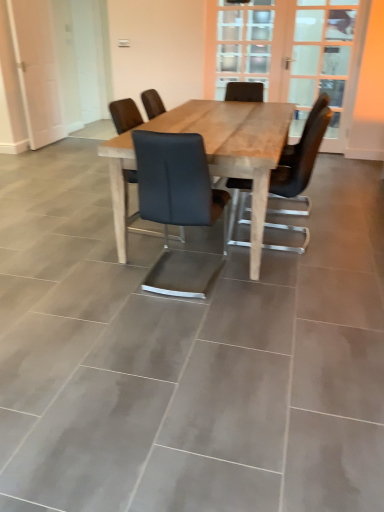
What do you see at coordinates (125, 115) in the screenshot?
I see `matte black chair at center, marked as the 3th chair in a right-to-left arrangement` at bounding box center [125, 115].

I want to click on white glossy door at left, the first screen door in the left-to-right sequence, so click(x=37, y=70).

Describe the element at coordinates (178, 207) in the screenshot. I see `black leather chair at center, the second chair in the right-to-left sequence` at that location.

Describe the element at coordinates (295, 55) in the screenshot. This screenshot has width=384, height=512. I see `clear glass door at upper center, which is the second screen door from left to right` at that location.

Find the location of `clear glass door at upper center, positioned as the first screen door in right-to-left order`. clear glass door at upper center, positioned as the first screen door in right-to-left order is located at coordinates (295, 55).

The width and height of the screenshot is (384, 512). I want to click on clear glass door at upper center, so click(244, 42).

In order to face matte black chair at center, placed as the third chair when sorted from left to right, should I rotate leftwards or rightwards?

A 11.699 degree turn to the right will do.

Where is `matte black chair at center, marked as the 3th chair in a right-to-left arrangement`? matte black chair at center, marked as the 3th chair in a right-to-left arrangement is located at coordinates coord(125,115).

How many degrees apart are the facing directions of clear glass door at upper center and clear glass door at upper center, which is the second screen door from left to right?

clear glass door at upper center and clear glass door at upper center, which is the second screen door from left to right, are facing 0.00318 degrees away from each other.

Does point (259, 66) appear closer or farther from the camera than point (281, 36)?

Point (259, 66) is positioned farther from the camera compared to point (281, 36).

Does clear glass door at upper center come in front of clear glass door at upper center, positioned as the first screen door in right-to-left order?

No, clear glass door at upper center is behind clear glass door at upper center, positioned as the first screen door in right-to-left order.

Based on their positions, is clear glass door at upper center located to the left or right of clear glass door at upper center, which is the second screen door from left to right?

Based on their positions, clear glass door at upper center is located to the left of clear glass door at upper center, which is the second screen door from left to right.

From the picture: Between matte black chair at center, marked as the 3th chair in a right-to-left arrangement, and clear glass door at upper center, which is the second screen door from left to right, which one has smaller size?

matte black chair at center, marked as the 3th chair in a right-to-left arrangement.

Looking at this image, does matte black chair at center, marked as the 3th chair in a right-to-left arrangement, have a lesser width compared to clear glass door at upper center, positioned as the first screen door in right-to-left order?

Incorrect, the width of matte black chair at center, marked as the 3th chair in a right-to-left arrangement, is not less than that of clear glass door at upper center, positioned as the first screen door in right-to-left order.

Does matte black chair at center, marked as the 3th chair in a right-to-left arrangement, contain clear glass door at upper center, which is the second screen door from left to right?

No, clear glass door at upper center, which is the second screen door from left to right, is not a part of matte black chair at center, marked as the 3th chair in a right-to-left arrangement.

Which object is closer to the camera taking this photo, clear glass door at upper center or natural wood table at center?

natural wood table at center is in front.

Does clear glass door at upper center have a greater height compared to natural wood table at center?

Yes, clear glass door at upper center is taller than natural wood table at center.

At what (x,y) coordinates should I click in order to perform the action: click on glass door above the natural wood table at center (from a real-world perspective). Please return your answer as a coordinate pair (x, y). Looking at the image, I should click on (244, 42).

Is clear glass door at upper center facing towards natural wood table at center?

Yes.

Between natural wood table at center and white glossy door at left, the first screen door in the left-to-right sequence, which one has larger size?

natural wood table at center.

Can you confirm if natural wood table at center is positioned to the left of white glossy door at left, the first screen door in the left-to-right sequence?

No, natural wood table at center is not to the left of white glossy door at left, the first screen door in the left-to-right sequence.

Measure the distance from natural wood table at center to white glossy door at left, which appears as the second screen door when viewed from the right.

natural wood table at center is 2.86 meters from white glossy door at left, which appears as the second screen door when viewed from the right.

From the image's perspective, is natural wood table at center above or below white glossy door at left, which appears as the second screen door when viewed from the right?

Clearly, from the image's perspective, natural wood table at center is below white glossy door at left, which appears as the second screen door when viewed from the right.

Is white glossy door at left, which appears as the second screen door when viewed from the right, located outside matte black chair at center, placed as the third chair when sorted from left to right?

white glossy door at left, which appears as the second screen door when viewed from the right, lies outside matte black chair at center, placed as the third chair when sorted from left to right,'s area.

Is white glossy door at left, which appears as the second screen door when viewed from the right, oriented away from matte black chair at center, placed as the third chair when sorted from left to right?

white glossy door at left, which appears as the second screen door when viewed from the right, is not turned away from matte black chair at center, placed as the third chair when sorted from left to right.

Considering the sizes of objects white glossy door at left, which appears as the second screen door when viewed from the right, and matte black chair at center, placed as the third chair when sorted from left to right, in the image provided, who is taller, white glossy door at left, which appears as the second screen door when viewed from the right, or matte black chair at center, placed as the third chair when sorted from left to right,?

white glossy door at left, which appears as the second screen door when viewed from the right.

From the image's perspective, does matte black chair at center, the first chair viewed from the right, appear higher than black leather chair at center, acting as the 2th chair starting from the left?

Indeed, from the image's perspective, matte black chair at center, the first chair viewed from the right, is shown above black leather chair at center, acting as the 2th chair starting from the left.

Based on their positions, is matte black chair at center, placed as the third chair when sorted from left to right, located to the left or right of black leather chair at center, acting as the 2th chair starting from the left?

Based on their positions, matte black chair at center, placed as the third chair when sorted from left to right, is located to the right of black leather chair at center, acting as the 2th chair starting from the left.

Is matte black chair at center, the first chair viewed from the right, next to black leather chair at center, the second chair in the right-to-left sequence?

No, matte black chair at center, the first chair viewed from the right, is not next to black leather chair at center, the second chair in the right-to-left sequence.

Which of these two, matte black chair at center, placed as the third chair when sorted from left to right, or black leather chair at center, acting as the 2th chair starting from the left, is smaller?

Smaller between the two is matte black chair at center, placed as the third chair when sorted from left to right.

Considering the sizes of clear glass door at upper center, which is the second screen door from left to right, and black leather chair at center, acting as the 2th chair starting from the left, in the image, is clear glass door at upper center, which is the second screen door from left to right, bigger or smaller than black leather chair at center, acting as the 2th chair starting from the left,?

In the image, clear glass door at upper center, which is the second screen door from left to right, appears to be larger than black leather chair at center, acting as the 2th chair starting from the left.

Is clear glass door at upper center, positioned as the first screen door in right-to-left order, not near black leather chair at center, the second chair in the right-to-left sequence?

Yes, clear glass door at upper center, positioned as the first screen door in right-to-left order, and black leather chair at center, the second chair in the right-to-left sequence, are quite far apart.

From a real-world perspective, which object rests below the other?

black leather chair at center, acting as the 2th chair starting from the left, from a real-world perspective.

Does clear glass door at upper center, which is the second screen door from left to right, contain black leather chair at center, the second chair in the right-to-left sequence?

No, black leather chair at center, the second chair in the right-to-left sequence, is not surrounded by clear glass door at upper center, which is the second screen door from left to right.

Where is `the 2nd screen door below the clear glass door at upper center (from the image's perspective)`? The height and width of the screenshot is (512, 384). the 2nd screen door below the clear glass door at upper center (from the image's perspective) is located at coordinates (295, 55).

Starting from the clear glass door at upper center, which is the second screen door from left to right, which chair is the 3rd one to the left? Please provide its 2D coordinates.

[(125, 115)]

Considering their positions, is black leather chair at center, acting as the 2th chair starting from the left, positioned further to clear glass door at upper center, which is the second screen door from left to right, than matte black chair at center, marked as the 3th chair in a right-to-left arrangement?

black leather chair at center, acting as the 2th chair starting from the left.

From the image, which object appears to be nearer to black leather chair at center, acting as the 2th chair starting from the left, natural wood table at center or matte black chair at center, placed as the third chair when sorted from left to right?

natural wood table at center.

When comparing their distances from natural wood table at center, does clear glass door at upper center, positioned as the first screen door in right-to-left order, or matte black chair at center, placed as the third chair when sorted from left to right, seem further?

clear glass door at upper center, positioned as the first screen door in right-to-left order, lies further to natural wood table at center than the other object.

Looking at the image, which one is located further to white glossy door at left, which appears as the second screen door when viewed from the right, clear glass door at upper center or natural wood table at center?

natural wood table at center.

Which object lies nearer to the anchor point natural wood table at center, black leather chair at center, acting as the 2th chair starting from the left, or white glossy door at left, the first screen door in the left-to-right sequence?

Among the two, black leather chair at center, acting as the 2th chair starting from the left, is located nearer to natural wood table at center.

Based on their spatial positions, is black leather chair at center, the second chair in the right-to-left sequence, or natural wood table at center closer to white glossy door at left, which appears as the second screen door when viewed from the right?

natural wood table at center lies closer to white glossy door at left, which appears as the second screen door when viewed from the right, than the other object.

From the image, which object appears to be farther from natural wood table at center, white glossy door at left, which appears as the second screen door when viewed from the right, or black leather chair at center, the second chair in the right-to-left sequence?

Based on the image, white glossy door at left, which appears as the second screen door when viewed from the right, appears to be further to natural wood table at center.

Consider the image. Based on their spatial positions, is clear glass door at upper center, positioned as the first screen door in right-to-left order, or matte black chair at center, placed as the 1th chair when sorted from left to right, closer to clear glass door at upper center?

clear glass door at upper center, positioned as the first screen door in right-to-left order, is closer to clear glass door at upper center.

This screenshot has height=512, width=384. I want to click on screen door located between black leather chair at center, acting as the 2th chair starting from the left, and white glossy door at left, the first screen door in the left-to-right sequence, in the depth direction, so coord(295,55).

Locate an element on the screen. This screenshot has width=384, height=512. kitchen & dining room table located between black leather chair at center, acting as the 2th chair starting from the left, and white glossy door at left, the first screen door in the left-to-right sequence, in the depth direction is located at coordinates (x=236, y=148).

Locate an element on the screen. The width and height of the screenshot is (384, 512). kitchen & dining room table situated between matte black chair at center, marked as the 3th chair in a right-to-left arrangement, and matte black chair at center, placed as the third chair when sorted from left to right, from left to right is located at coordinates (236, 148).

This screenshot has height=512, width=384. What are the coordinates of `glass door situated between white glossy door at left, the first screen door in the left-to-right sequence, and clear glass door at upper center, which is the second screen door from left to right, from left to right` in the screenshot? It's located at (244, 42).